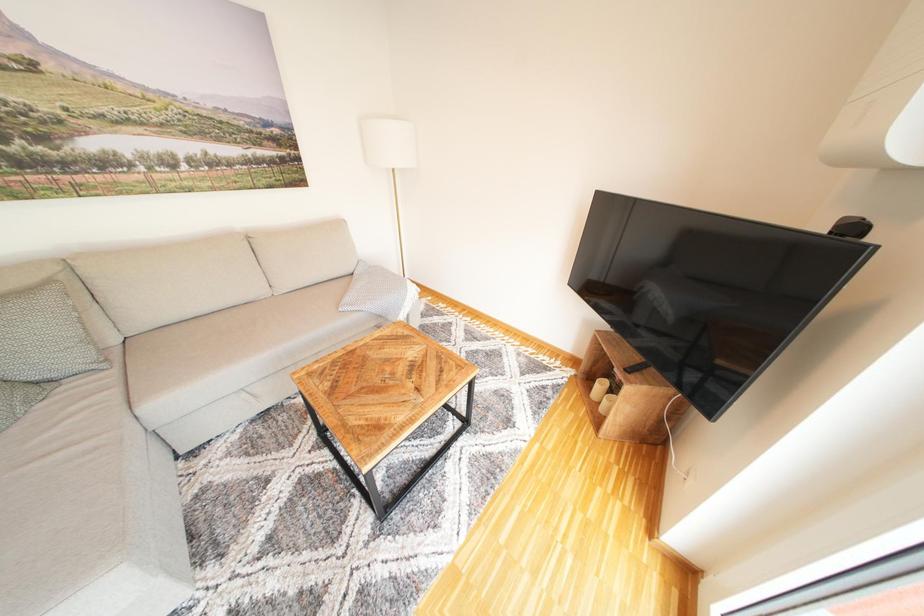
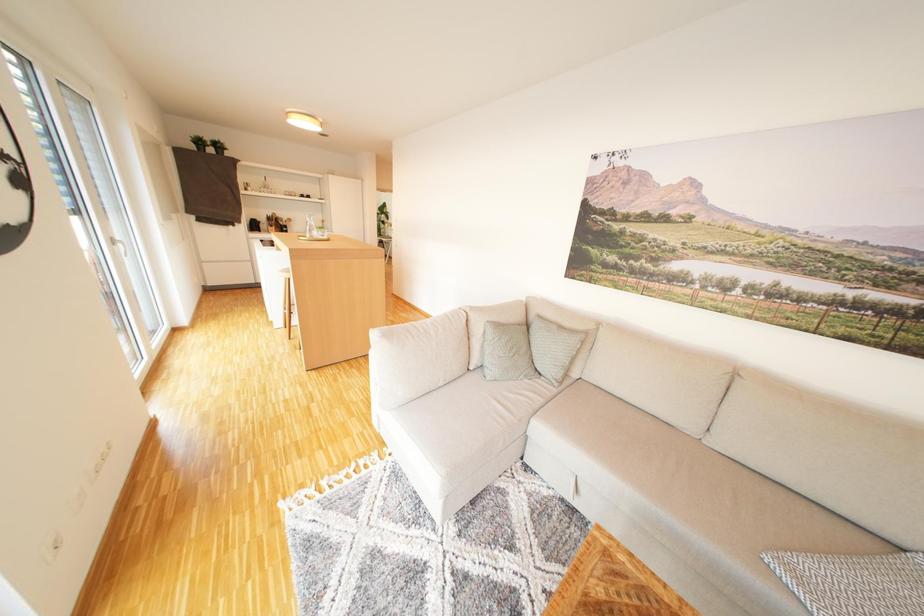
The images are taken continuously from a first-person perspective. In which direction is your viewpoint rotating?

The rotation direction of the camera is left-down.